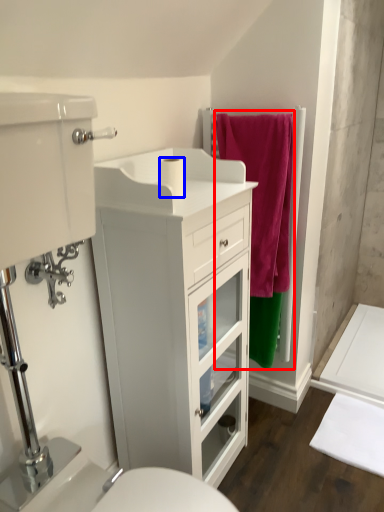
Question: Which of the following is the farthest to the observer, bath towel (highlighted by a red box) or toilet paper (highlighted by a blue box)?

Choices:
 (A) bath towel
 (B) toilet paper

Answer: (A)